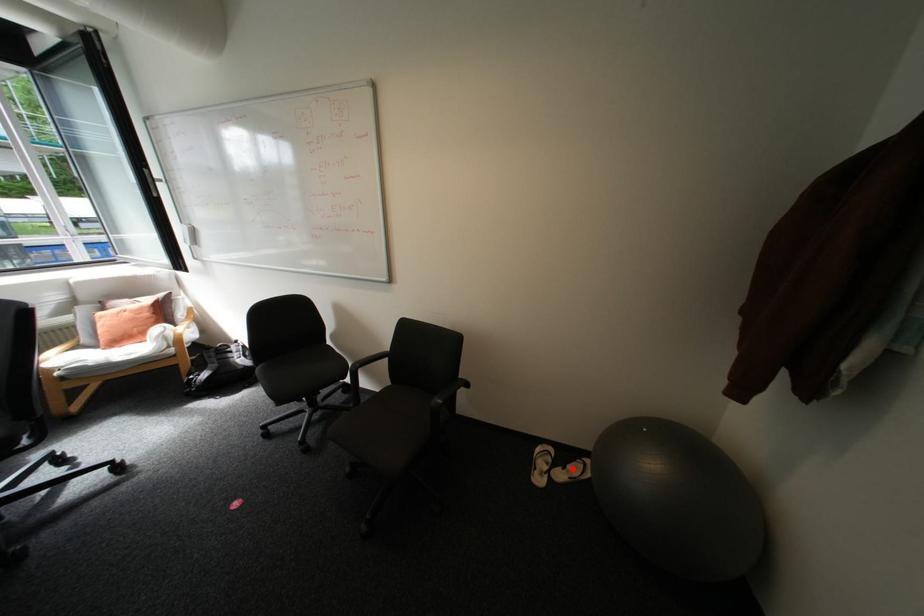
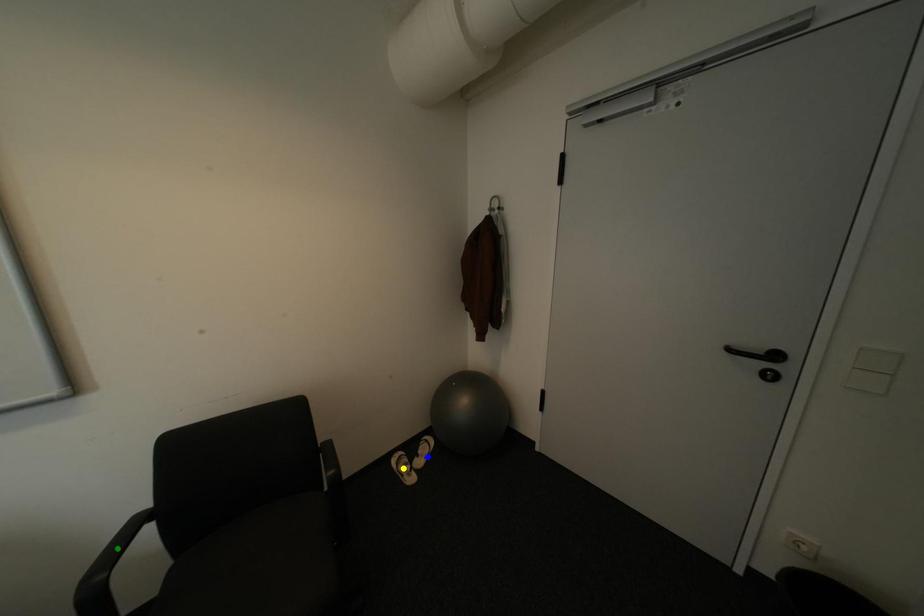
Question: I am providing you with two images of the same scene from different viewpoints. A red point is marked on the first image. You are given multiple points on the second image. Which spot in image 2 lines up with the point in image 1?

Choices:
 (A) green point
 (B) blue point
 (C) yellow point

Answer: (B)